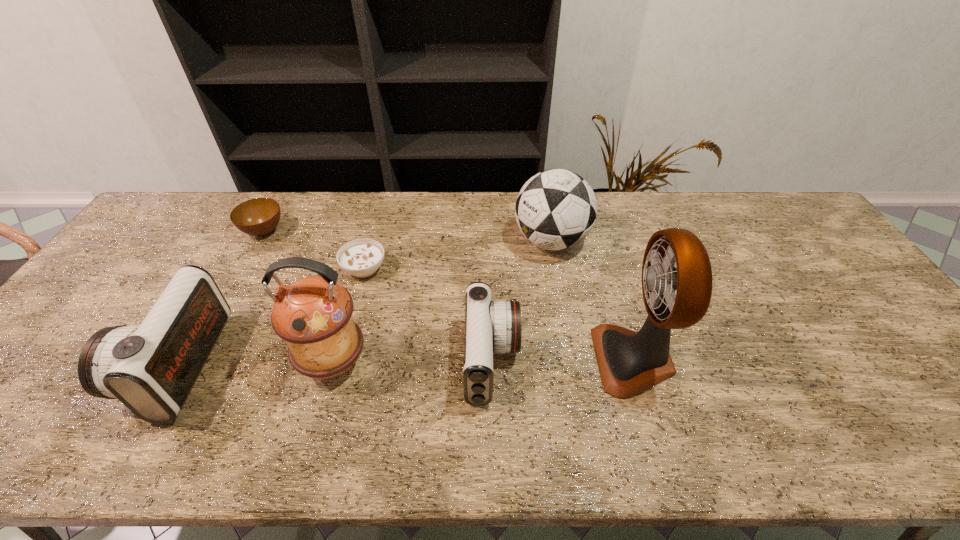
At what (x,y) coordinates should I click in order to perform the action: click on object that is the fifth closest to the oil lamp. Please return your answer as a coordinate pair (x, y). The height and width of the screenshot is (540, 960). Looking at the image, I should click on (556, 209).

Image resolution: width=960 pixels, height=540 pixels. I want to click on vacant space that satisfies the following two spatial constraints: 1. on the front side of the oil lamp; 2. on the surface of the fourth shortest object, so click(333, 364).